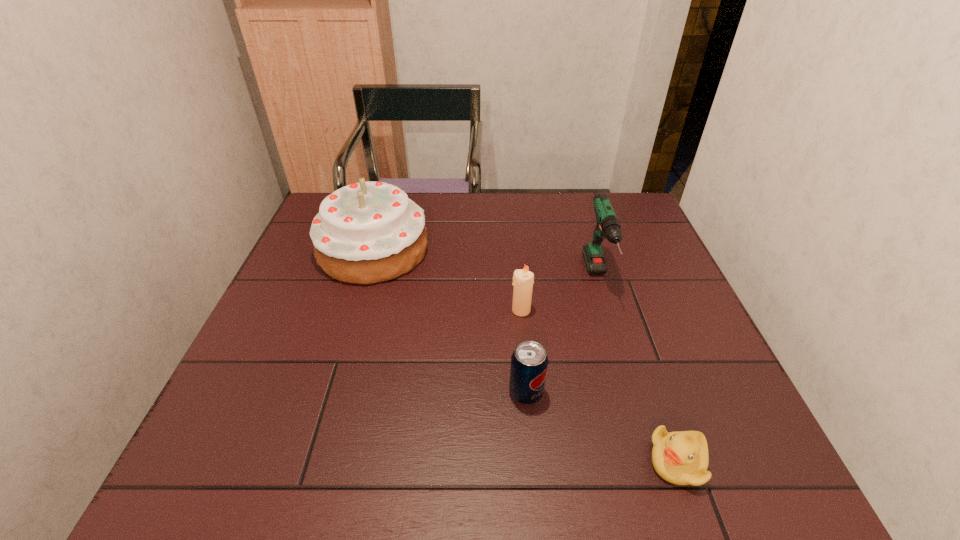
The height and width of the screenshot is (540, 960). What are the coordinates of `the leftmost object` in the screenshot? It's located at (368, 232).

The height and width of the screenshot is (540, 960). I want to click on drill, so click(x=608, y=227).

Identify the location of candle. (523, 280).

Where is `the second shortest object`? The image size is (960, 540). the second shortest object is located at coordinates 529,362.

Where is `soda can`? This screenshot has height=540, width=960. soda can is located at coordinates (529, 362).

The height and width of the screenshot is (540, 960). I want to click on the shortest object, so click(x=681, y=458).

Identify the location of duckling. (681, 458).

The width and height of the screenshot is (960, 540). Find the location of `free region located on the front of the cake`. free region located on the front of the cake is located at coordinates (351, 324).

The width and height of the screenshot is (960, 540). Find the location of `free region located 0.220m on the handle side of the drill`. free region located 0.220m on the handle side of the drill is located at coordinates (631, 386).

You are a GUI agent. You are given a task and a screenshot of the screen. Output one action in this format:
    pyautogui.click(x=<x>, y=<y>)
    Task: Click on the free space located 0.120m on the left of the candle
    The width and height of the screenshot is (960, 540).
    Given the screenshot: What is the action you would take?
    coord(462,310)